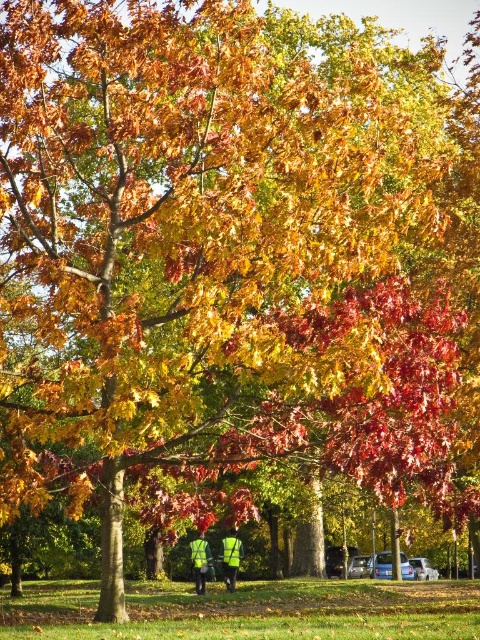
Question: From the image, what is the correct spatial relationship of high-visibility reflective vest at center in relation to high-visibility fabric person at center?

Choices:
 (A) above
 (B) below

Answer: (A)

Question: Which point is farther to the camera?

Choices:
 (A) (236, 572)
 (B) (201, 532)

Answer: (A)

Question: Which of the following is the closest to the observer?

Choices:
 (A) (200, 580)
 (B) (228, 576)

Answer: (A)

Question: Is high-visibility reflective vest at center behind high-visibility fabric person at center?

Choices:
 (A) yes
 (B) no

Answer: (B)

Question: Observing the image, what is the correct spatial positioning of high-visibility reflective vest at center in reference to high-visibility fabric person at center?

Choices:
 (A) left
 (B) right

Answer: (A)

Question: Among these objects, which one is nearest to the camera?

Choices:
 (A) high-visibility fabric person at center
 (B) high-visibility reflective vest at center

Answer: (B)